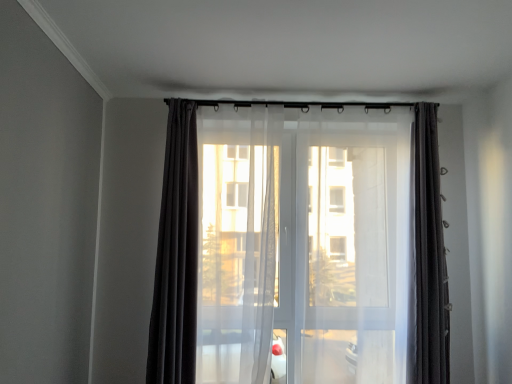
Question: From the image's perspective, is matte black curtain at center, acting as the first curtain starting from the left, positioned above or below matte black curtain at center, the first curtain viewed from the right?

Choices:
 (A) below
 (B) above

Answer: (B)

Question: Is matte black curtain at center, acting as the first curtain starting from the left, wider or thinner than matte black curtain at center, which is the 3th curtain in left-to-right order?

Choices:
 (A) wide
 (B) thin

Answer: (A)

Question: Which is nearer to the sheer white curtain at center, positioned as the 2th curtain in right-to-left order?

Choices:
 (A) transparent fabric screen door at center
 (B) matte black curtain at center, which is the 3th curtain in left-to-right order
 (C) matte black curtain at center, acting as the first curtain starting from the left

Answer: (C)

Question: Considering the real-world distances, which object is farthest from the matte black curtain at center, which is the 3th curtain in left-to-right order?

Choices:
 (A) matte black curtain at center, which ranks as the third curtain in right-to-left order
 (B) sheer white curtain at center, the 2th curtain when ordered from left to right
 (C) transparent fabric screen door at center

Answer: (B)